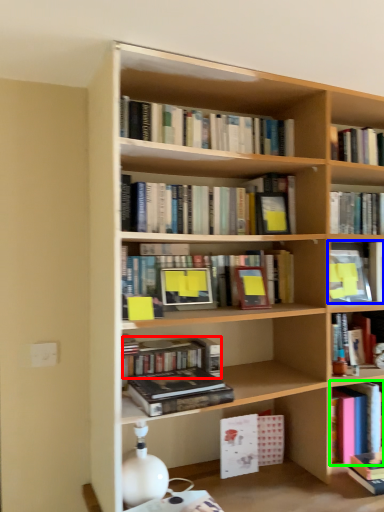
Question: Which is nearer to the book (highlighted by a red box)? book (highlighted by a blue box) or book (highlighted by a green box).

Choices:
 (A) book
 (B) book

Answer: (A)